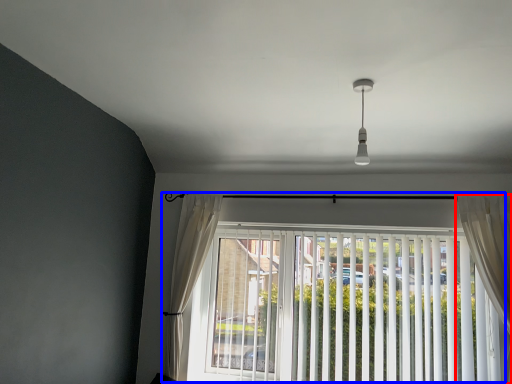
Question: Which object is closer to the camera taking this photo, curtain (highlighted by a red box) or window (highlighted by a blue box)?

Choices:
 (A) curtain
 (B) window

Answer: (A)